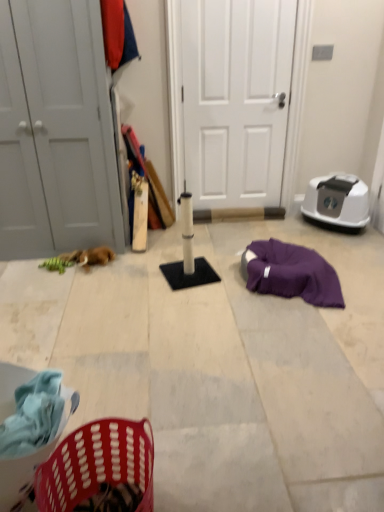
This screenshot has width=384, height=512. I want to click on free spot to the right of brown plush toy at left, so click(139, 263).